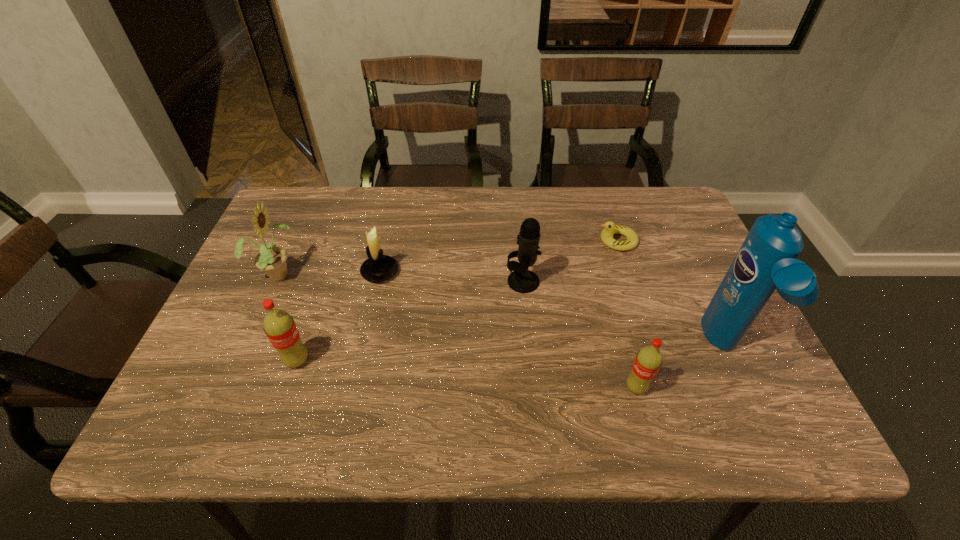
This screenshot has width=960, height=540. I want to click on object that is the second closest to the shorter soda, so click(521, 280).

This screenshot has width=960, height=540. I want to click on object that is the fifth closest one to the third object from left to right, so click(x=648, y=361).

The width and height of the screenshot is (960, 540). I want to click on vacant area that satisfies the following two spatial constraints: 1. on the front-facing side of the sunflower; 2. on the right side of the left soda, so click(x=240, y=361).

Identify the location of free space in the image that satisfies the following two spatial constraints: 1. on the back side of the farther soda; 2. on the left side of the fifth object from right to left. This screenshot has width=960, height=540. (327, 272).

This screenshot has width=960, height=540. Find the location of `free location that satisfies the following two spatial constraints: 1. on the back side of the farther soda; 2. on the right side of the rightmost object`. free location that satisfies the following two spatial constraints: 1. on the back side of the farther soda; 2. on the right side of the rightmost object is located at coordinates (301, 348).

Locate an element on the screen. The width and height of the screenshot is (960, 540). free region that satisfies the following two spatial constraints: 1. on the front-facing side of the taller soda; 2. on the left side of the leftmost object is located at coordinates (240, 361).

I want to click on free spot that satisfies the following two spatial constraints: 1. on the front-facing side of the leftmost object; 2. on the left side of the left soda, so click(x=240, y=361).

Where is `free space that satisfies the following two spatial constraints: 1. on the back side of the tallest object; 2. on the face of the shortest object`? free space that satisfies the following two spatial constraints: 1. on the back side of the tallest object; 2. on the face of the shortest object is located at coordinates (675, 241).